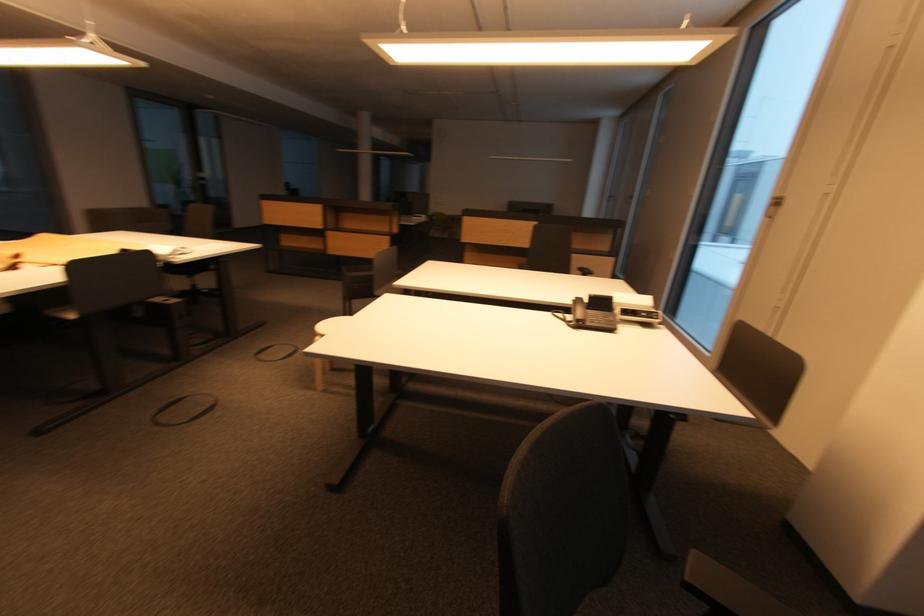
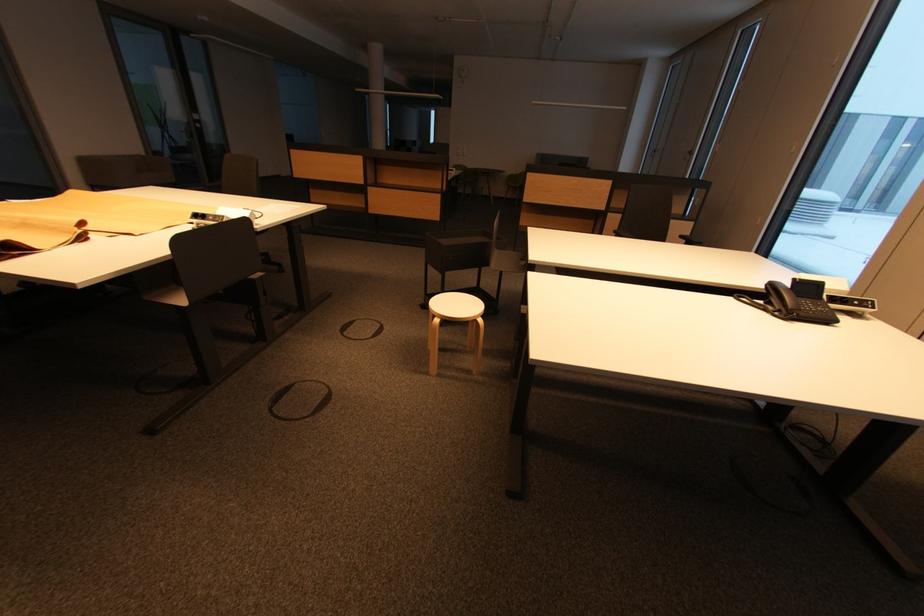
Question: The images are taken continuously from a first-person perspective. In which direction are you moving?

Choices:
 (A) Left
 (B) Right
 (C) Forward
 (D) Backward

Answer: (A)